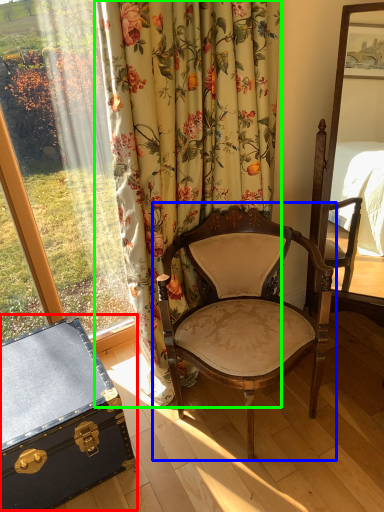
Question: Which is farther away from chest (highlighted by a red box)? chair (highlighted by a blue box) or curtain (highlighted by a green box)?

Choices:
 (A) chair
 (B) curtain

Answer: (B)